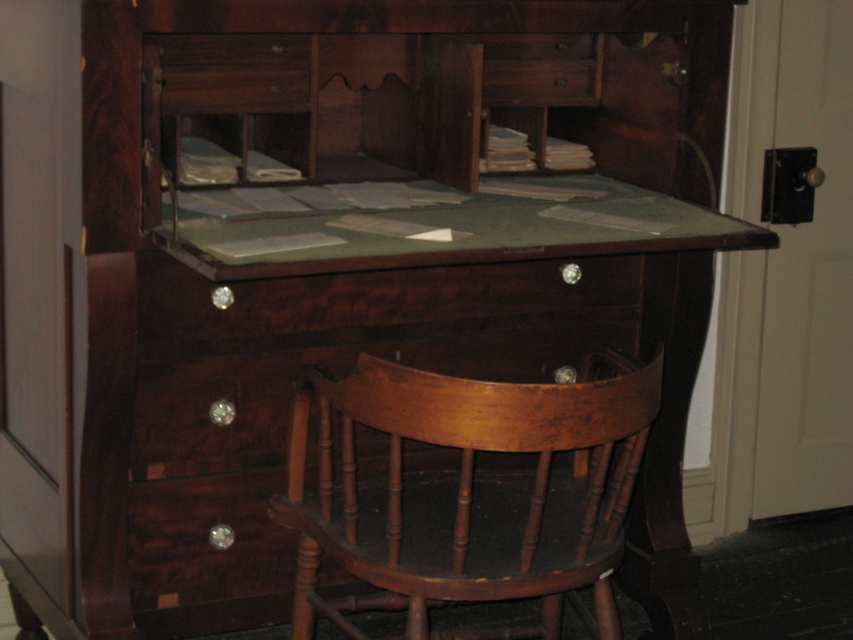
Question: Which point is closer to the camera?

Choices:
 (A) shiny dark wood drawer at center
 (B) light brown wood chair at center

Answer: (B)

Question: Is light brown wood chair at center further to camera compared to shiny dark wood drawer at center?

Choices:
 (A) yes
 (B) no

Answer: (B)

Question: Which point is farther to the camera?

Choices:
 (A) [321, 435]
 (B) [196, 289]

Answer: (B)

Question: Which point is closer to the camera taking this photo?

Choices:
 (A) (143, 300)
 (B) (592, 433)

Answer: (B)

Question: Is light brown wood chair at center thinner than shiny dark wood drawer at center?

Choices:
 (A) no
 (B) yes

Answer: (B)

Question: Does light brown wood chair at center have a greater width compared to shiny dark wood drawer at center?

Choices:
 (A) no
 (B) yes

Answer: (A)